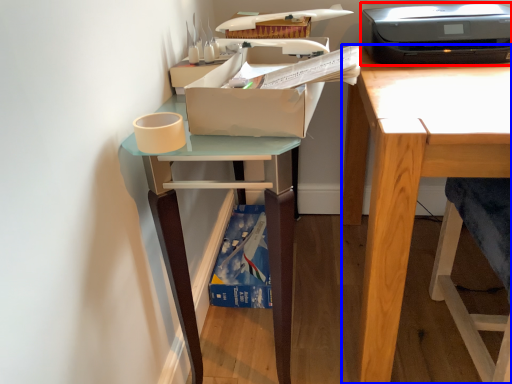
Question: Which object is further to the camera taking this photo, printer (highlighted by a red box) or desk (highlighted by a blue box)?

Choices:
 (A) printer
 (B) desk

Answer: (A)